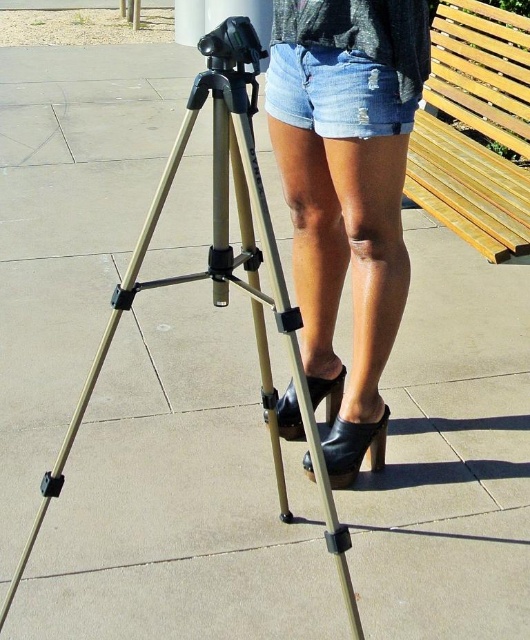
Can you confirm if denim shorts at center is positioned below light brown wooden bench at upper right?

Indeed, denim shorts at center is positioned under light brown wooden bench at upper right.

Between point (311, 189) and point (464, 4), which one is positioned in front?

Positioned in front is point (311, 189).

Find the location of `denim shorts at center`. denim shorts at center is located at coordinates (347, 192).

Who is shorter, denim shorts at center or denim shorts at upper center?

Standing shorter between the two is denim shorts at upper center.

Does denim shorts at center have a lesser width compared to denim shorts at upper center?

In fact, denim shorts at center might be wider than denim shorts at upper center.

Between point (281, 406) and point (340, 65), which one is positioned in front?

Positioned in front is point (340, 65).

You are a GUI agent. You are given a task and a screenshot of the screen. Output one action in this format:
    pyautogui.click(x=<x>, y=<y>)
    Task: Click on the denim shorts at center
    
    Given the screenshot: What is the action you would take?
    pyautogui.click(x=347, y=192)

Is point (265, 198) positioned before point (499, 93)?

That is True.

Does metallic tripod at center appear on the right side of light brown wooden bench at upper right?

In fact, metallic tripod at center is to the left of light brown wooden bench at upper right.

At what (x,y) coordinates should I click in order to perform the action: click on metallic tripod at center. Please return your answer as a coordinate pair (x, y). The height and width of the screenshot is (640, 530). Looking at the image, I should click on (222, 273).